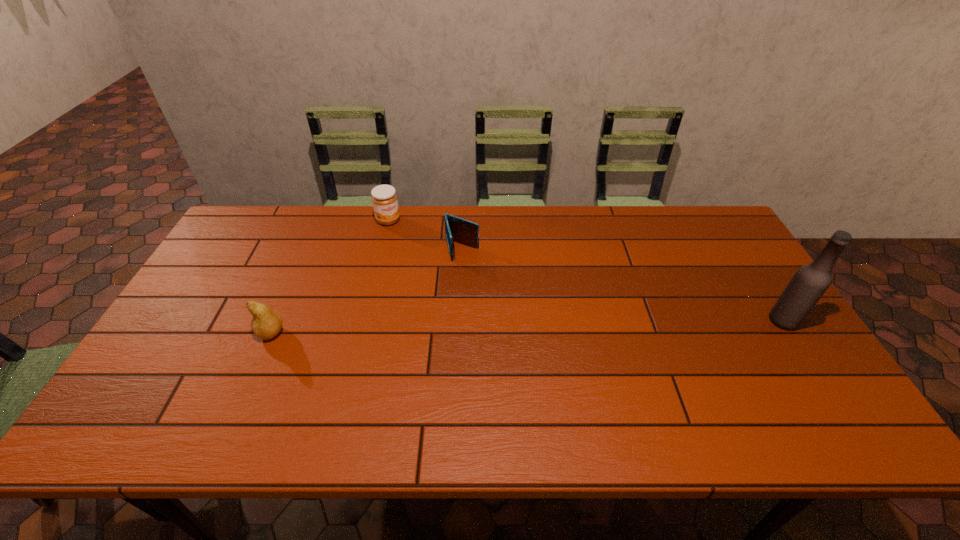
Locate an element on the screen. vacant space on the desktop that is between the pear and the beer bottle and is positioned on the exterior surface of the second object from right to left is located at coordinates (484, 328).

At what (x,y) coordinates should I click in order to perform the action: click on vacant space on the desktop that is between the pear and the beer bottle and is positioned on the front label of the third object from right to left. Please return your answer as a coordinate pair (x, y). The width and height of the screenshot is (960, 540). Looking at the image, I should click on (468, 328).